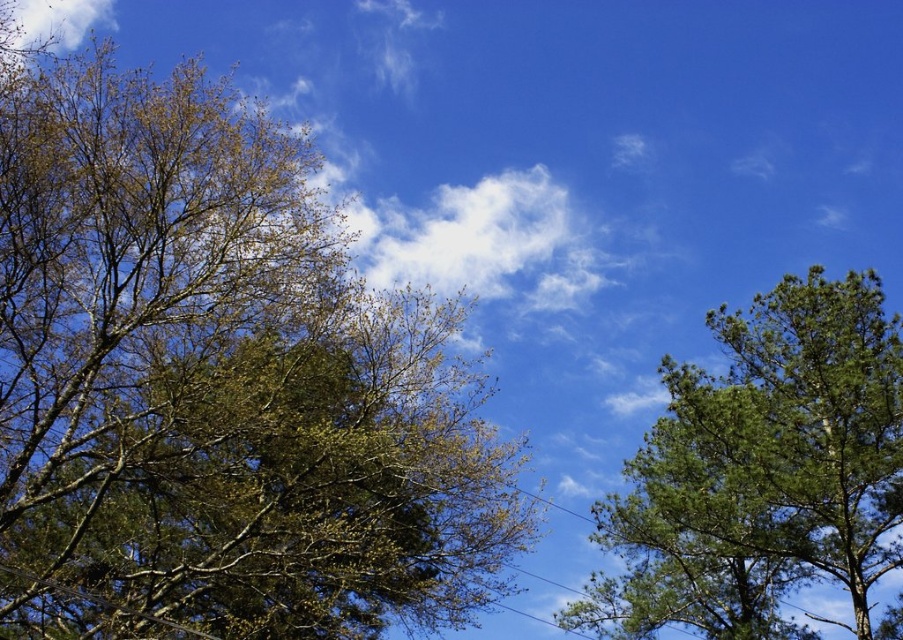
Question: Does green leafy tree at left have a smaller size compared to green textured tree at right?

Choices:
 (A) yes
 (B) no

Answer: (B)

Question: Among these objects, which one is farthest from the camera?

Choices:
 (A) green textured tree at right
 (B) green leafy tree at left

Answer: (A)

Question: Which object is closer to the camera taking this photo?

Choices:
 (A) green leafy tree at left
 (B) green textured tree at right

Answer: (A)

Question: Is green leafy tree at left to the left of green textured tree at right from the viewer's perspective?

Choices:
 (A) yes
 (B) no

Answer: (A)

Question: Which of the following is the closest to the observer?

Choices:
 (A) click(x=222, y=440)
 (B) click(x=697, y=602)

Answer: (A)

Question: Does green leafy tree at left have a smaller size compared to green textured tree at right?

Choices:
 (A) yes
 (B) no

Answer: (B)